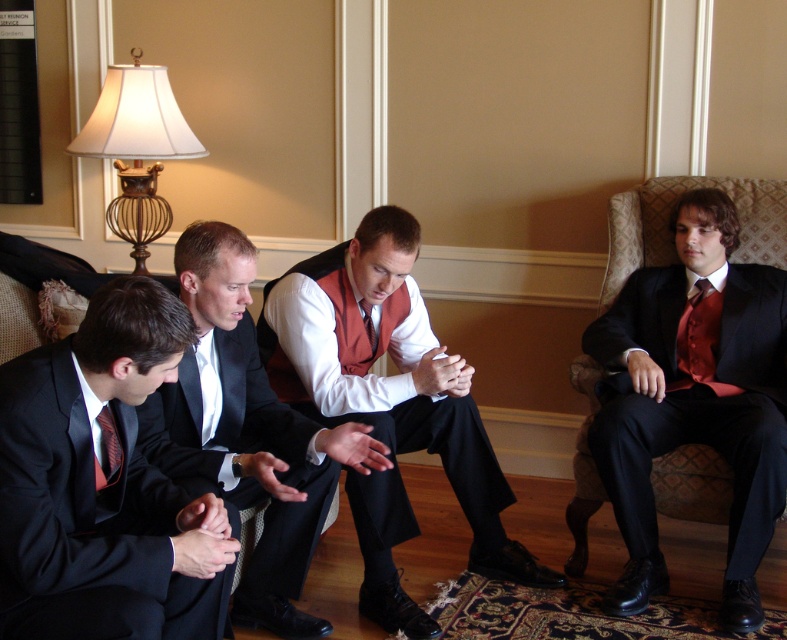
You are a photographer standing in the room and want to take a photo of the matte black suit at right and the matte cream lampshade at upper left. Which object will appear larger in the photo?

The matte black suit at right will appear larger in the photo because it is closer to the viewer than the matte cream lampshade at upper left.

Looking at this image, you are a photographer trying to capture a photo of the two men in matte black suits. Since the matte black suit at left and the matte black suit at right are positioned in a way that one is partially blocking the other, which one should you focus on to ensure the other is visible in the background?

The matte black suit at left is positioned under the matte black suit at right, so focusing on the matte black suit at right will allow the matte black suit at left to be visible in the background.

You are standing in the room and want to know if the matte black suit at right is positioned lower than the matte cream lampshade at upper left. Based on the scene description, can you determine this?

Yes, the matte black suit at right is below the matte cream lampshade at upper left according to the description.